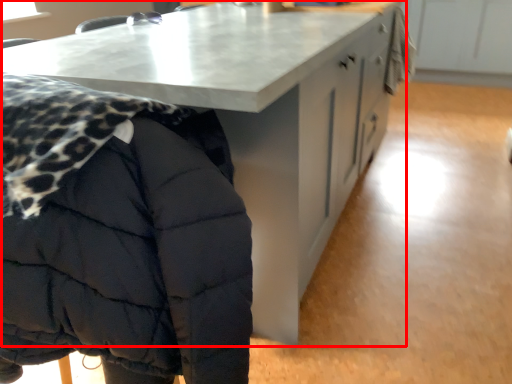
Question: From the image's perspective, where is table (annotated by the red box) located in relation to jacket in the image?

Choices:
 (A) above
 (B) below

Answer: (A)